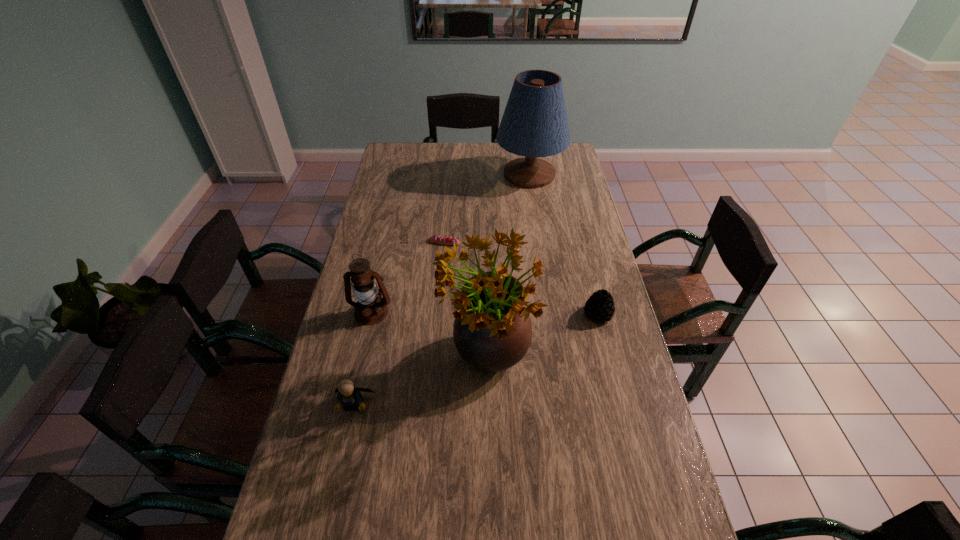
Select which object appears as the closest to the flower arrangement. Please provide its 2D coordinates. Your answer should be formatted as a tuple, i.e. [(x, y)], where the tuple contains the x and y coordinates of a point satisfying the conditions above.

[(370, 309)]

Locate which object is the second closest to the flower arrangement. Please provide its 2D coordinates. Your answer should be formatted as a tuple, i.e. [(x, y)], where the tuple contains the x and y coordinates of a point satisfying the conditions above.

[(348, 395)]